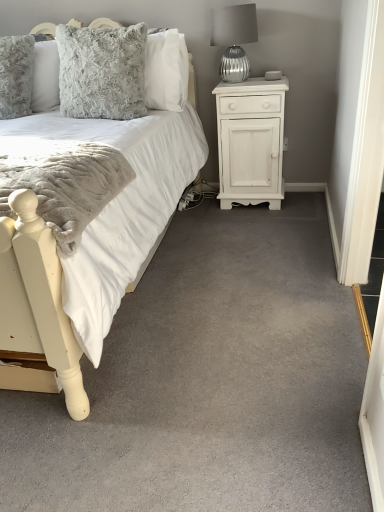
Where is `free space to the left of white painted wood nightstand at right`? The height and width of the screenshot is (512, 384). free space to the left of white painted wood nightstand at right is located at coordinates (198, 212).